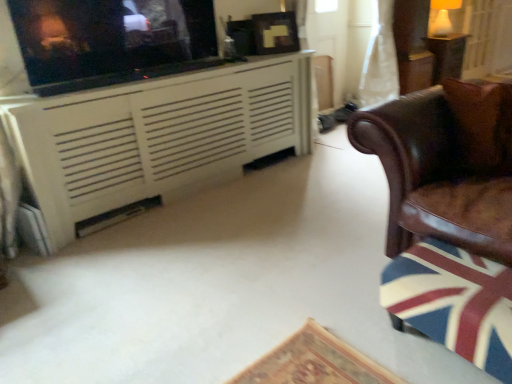
You are a GUI agent. You are given a task and a screenshot of the screen. Output one action in this format:
    pyautogui.click(x=<x>, y=<y>)
    Task: Click on the vacant space to the left of brown leather chair at right
    
    Given the screenshot: What is the action you would take?
    pyautogui.click(x=280, y=267)